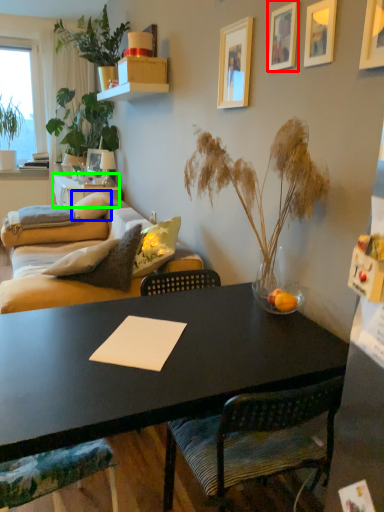
Question: Based on their relative distances, which object is nearer to picture frame (highlighted by a red box)? Choose from pillow (highlighted by a blue box) and desk (highlighted by a green box).

Choices:
 (A) pillow
 (B) desk

Answer: (A)